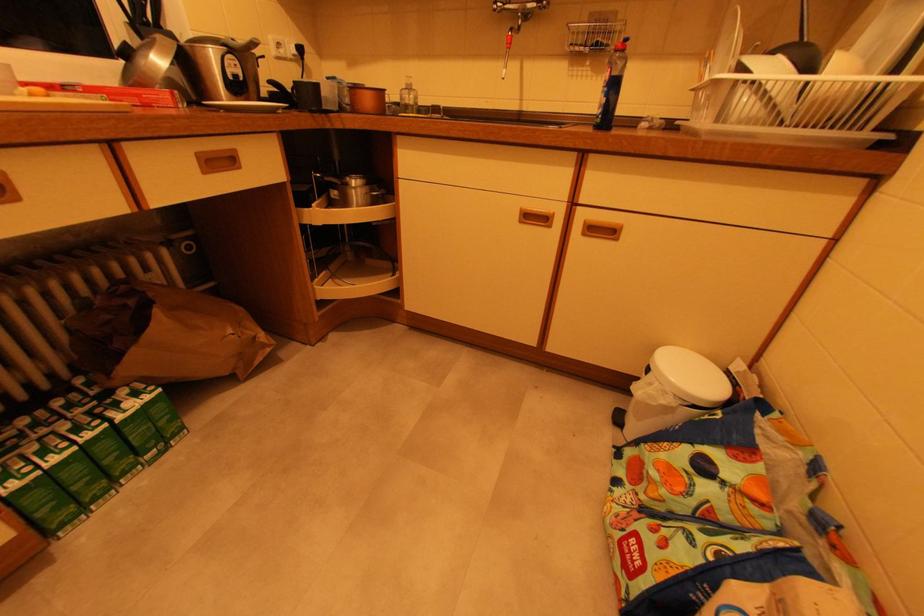
The image size is (924, 616). Describe the element at coordinates (280, 92) in the screenshot. I see `the black kettle handle` at that location.